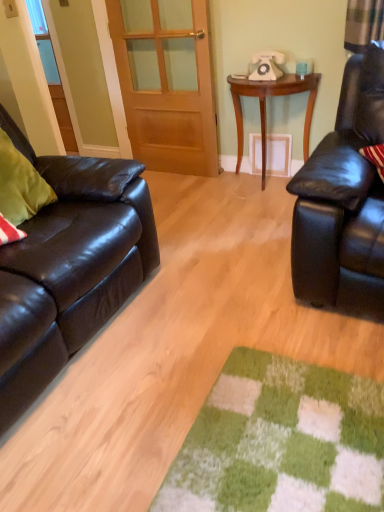
Locate an element on the screen. The height and width of the screenshot is (512, 384). unoccupied region to the right of shiny black leather couch at left is located at coordinates (216, 313).